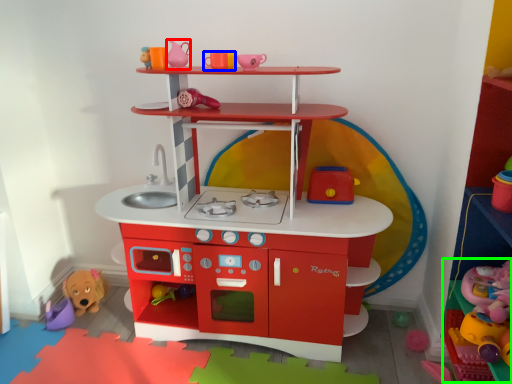
Question: Considering the real-world distances, which object is closest to toy (highlighted by a red box)? toy (highlighted by a blue box) or toy (highlighted by a green box).

Choices:
 (A) toy
 (B) toy

Answer: (A)